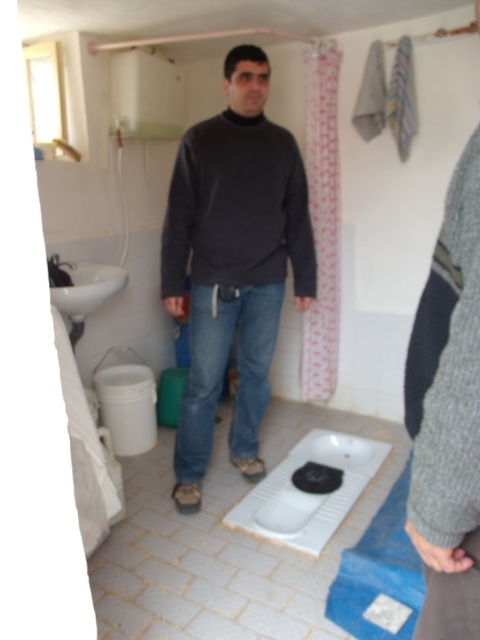
Question: Is white glossy urinal at center positioned before white glossy sink at left?

Choices:
 (A) no
 (B) yes

Answer: (B)

Question: Can you confirm if dark gray sweater at center is thinner than blue fabric mat at lower center?

Choices:
 (A) yes
 (B) no

Answer: (B)

Question: Which object appears closest to the camera in this image?

Choices:
 (A) blue fabric mat at lower center
 (B) white glossy sink at left
 (C) white glossy urinal at center
 (D) dark gray sweater at center

Answer: (A)

Question: Among these objects, which one is nearest to the camera?

Choices:
 (A) white glossy sink at left
 (B) white glossy urinal at center

Answer: (B)

Question: Is blue fabric mat at lower center wider than white glossy sink at left?

Choices:
 (A) no
 (B) yes

Answer: (B)

Question: Based on their relative distances, which object is nearer to the white glossy urinal at center?

Choices:
 (A) dark gray sweater at center
 (B) blue fabric mat at lower center

Answer: (B)